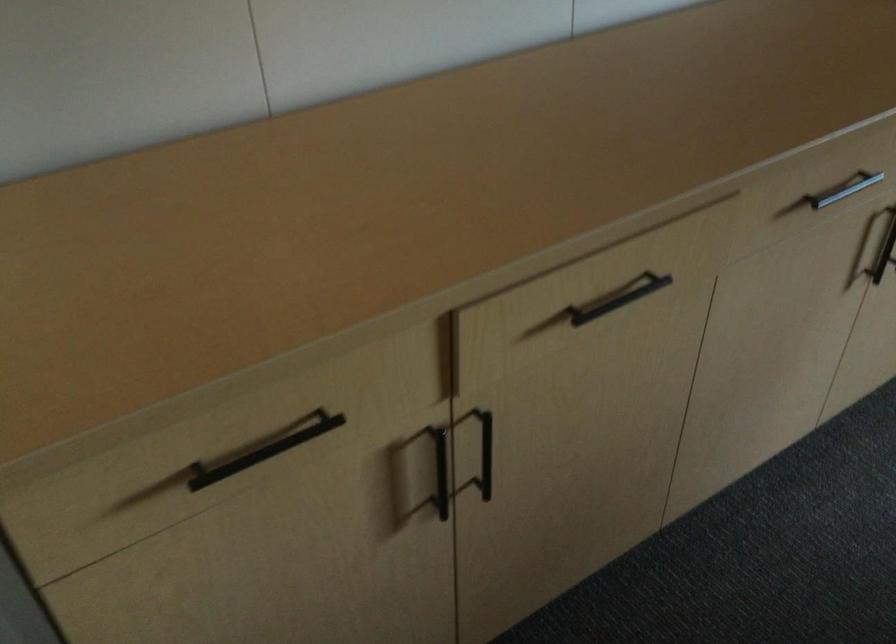
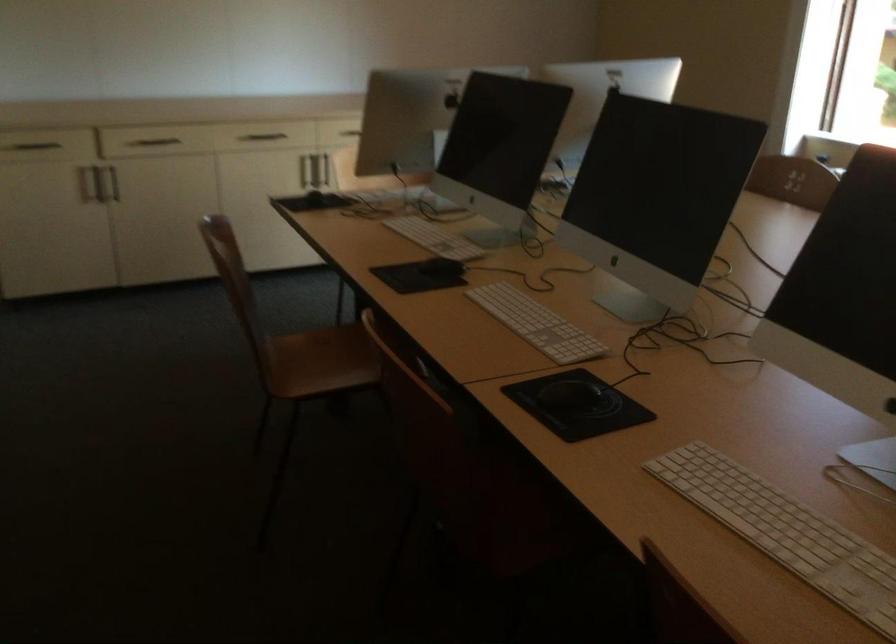
What movement of the cameraman would produce the second image?

The movement direction of the cameraman is right, backward.